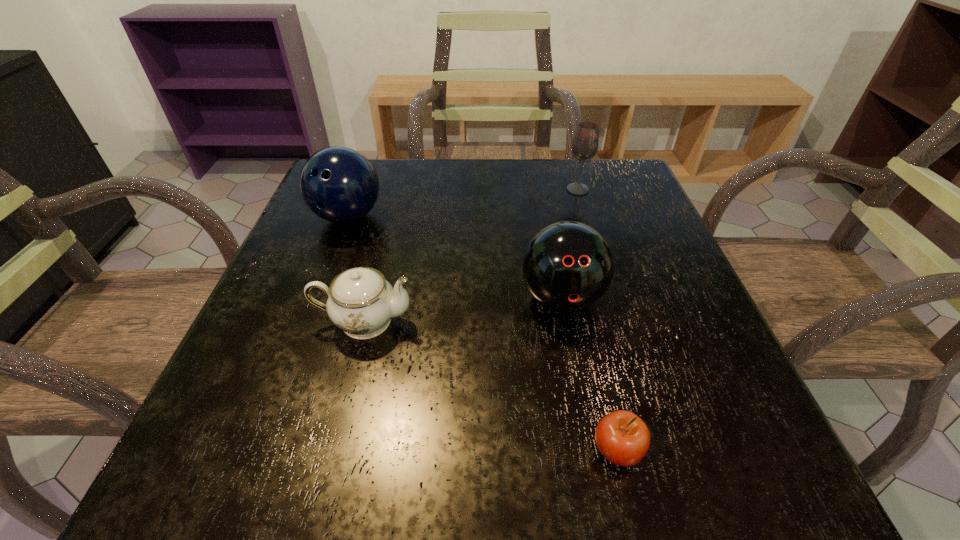
Image resolution: width=960 pixels, height=540 pixels. Identify the location of glass drink container. (585, 143).

You are a GUI agent. You are given a task and a screenshot of the screen. Output one action in this format:
    pyautogui.click(x=<x>, y=<y>)
    Task: Click on the farther bowling ball
    The width and height of the screenshot is (960, 540).
    Given the screenshot: What is the action you would take?
    pyautogui.click(x=339, y=184)

This screenshot has height=540, width=960. Identify the location of the fourth nearest object. (339, 184).

Image resolution: width=960 pixels, height=540 pixels. Identify the location of the right bowling ball. (567, 265).

At what (x,y) coordinates should I click in order to perform the action: click on the fourth tallest object. Please return your answer as a coordinate pair (x, y). Looking at the image, I should click on (360, 301).

At what (x,y) coordinates should I click in order to perform the action: click on the shortest object. Please return your answer as a coordinate pair (x, y). The width and height of the screenshot is (960, 540). Looking at the image, I should click on (622, 437).

Image resolution: width=960 pixels, height=540 pixels. In order to click on apple in this screenshot , I will do coord(622,437).

I want to click on vacant space located 0.320m on the left of the farthest object, so click(427, 190).

You are a GUI agent. You are given a task and a screenshot of the screen. Output one action in this format:
    pyautogui.click(x=<x>, y=<y>)
    Task: Click on the vacant position located 0.290m on the surface of the fourth nearest object near the finger holes
    
    Given the screenshot: What is the action you would take?
    pyautogui.click(x=296, y=356)

The image size is (960, 540). Identify the location of blank space located on the surface of the nearer bowling ball near the finger holes. (578, 383).